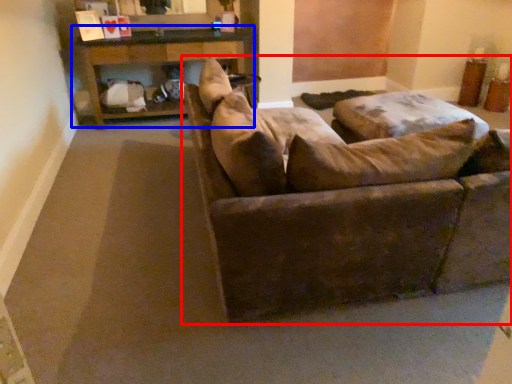
Question: Which object is closer to the camera taking this photo, studio couch (highlighted by a red box) or table (highlighted by a blue box)?

Choices:
 (A) studio couch
 (B) table

Answer: (A)